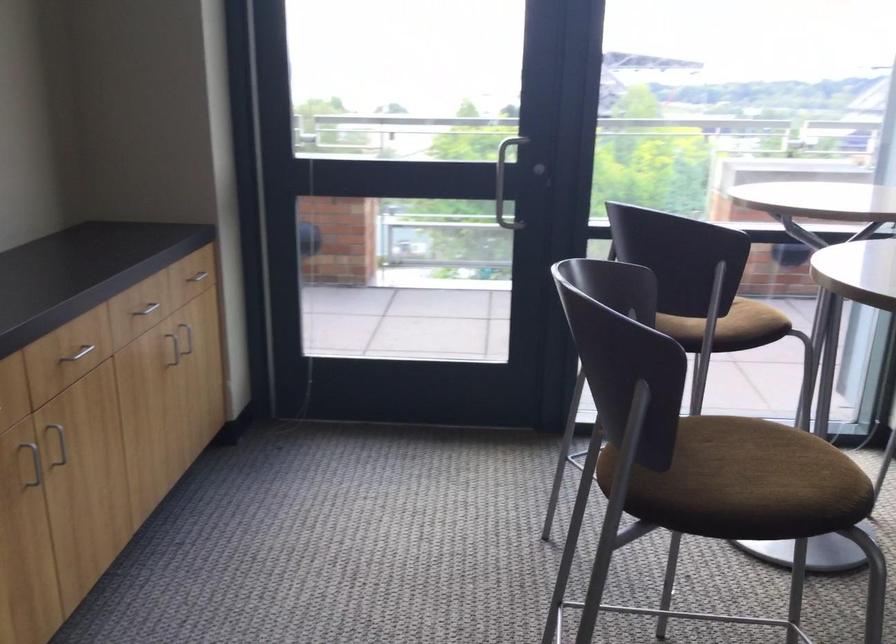
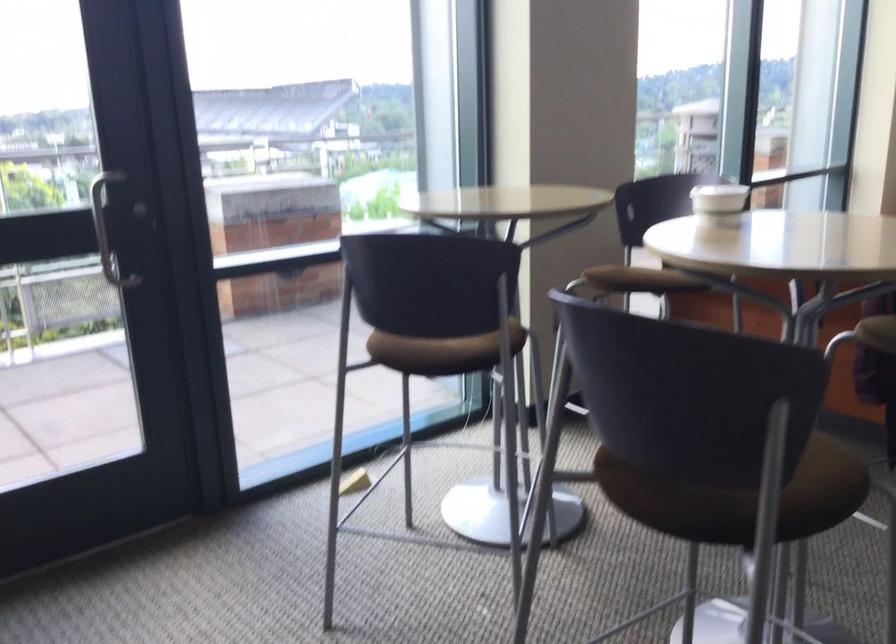
Question: The first image is from the beginning of the video and the second image is from the end. How did the camera likely rotate when shooting the video?

Choices:
 (A) Left
 (B) Right
 (C) Up
 (D) Down

Answer: (B)